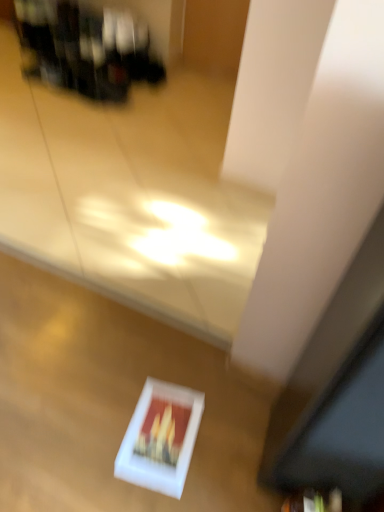
This screenshot has width=384, height=512. I want to click on free point above white matte picture frame at lower center (from a real-world perspective), so click(x=161, y=430).